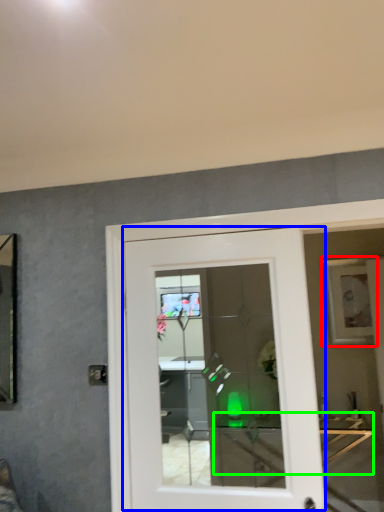
Question: Based on their relative distances, which object is farther from picture frame (highlighted by a red box)? Choose from door (highlighted by a blue box) and table (highlighted by a green box).

Choices:
 (A) door
 (B) table

Answer: (A)